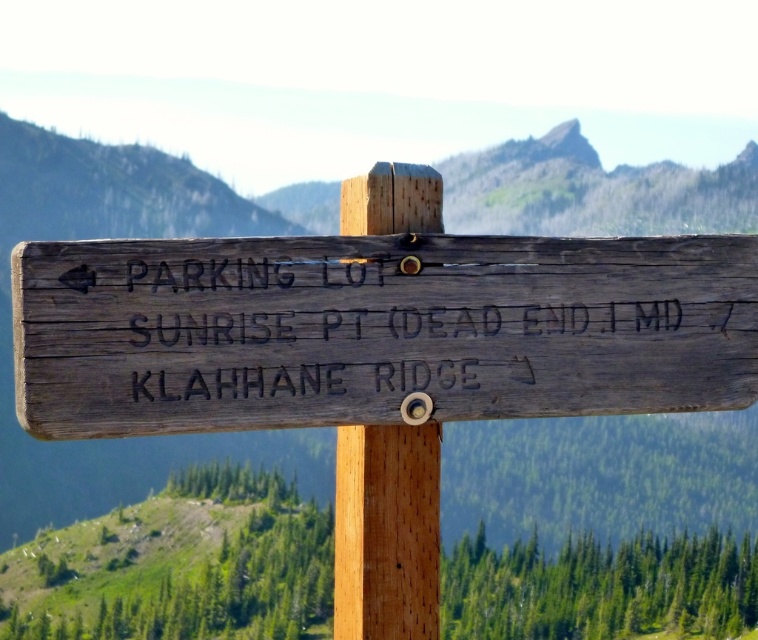
Question: Is weathered wood sign at center thinner than wooden post at center?

Choices:
 (A) no
 (B) yes

Answer: (A)

Question: Observing the image, what is the correct spatial positioning of wooden post at center in reference to smooth gray rock at upper center?

Choices:
 (A) left
 (B) right

Answer: (A)

Question: Among these objects, which one is farthest from the camera?

Choices:
 (A) weathered wood sign at center
 (B) smooth gray rock at upper center
 (C) wooden post at center

Answer: (B)

Question: Which of these objects is positioned farthest from the weathered wood sign at center?

Choices:
 (A) smooth gray rock at upper center
 (B) wooden post at center

Answer: (A)

Question: Does weathered wood sign at center appear on the right side of smooth gray rock at upper center?

Choices:
 (A) no
 (B) yes

Answer: (A)

Question: Which of the following is the closest to the observer?

Choices:
 (A) (590, 156)
 (B) (39, 384)

Answer: (B)